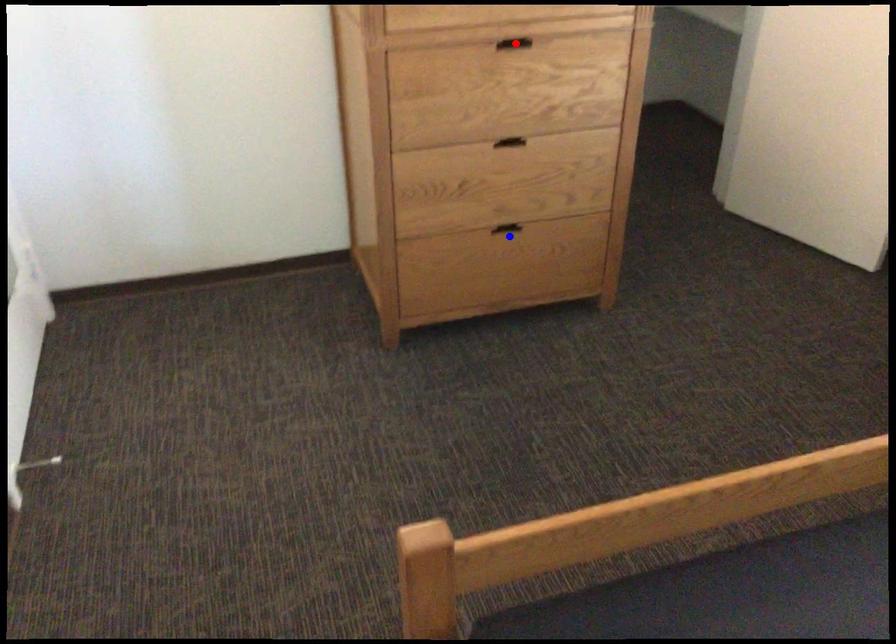
Question: In the image, two points are highlighted. Which point is nearer to the camera? Reply with the corresponding letter.

Choices:
 (A) blue point
 (B) red point

Answer: (B)